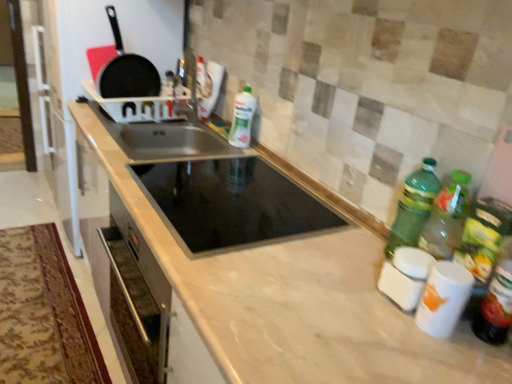
I want to click on free space behind green plastic bottle at right, the 2th bottle when ordered from left to right, so click(x=357, y=222).